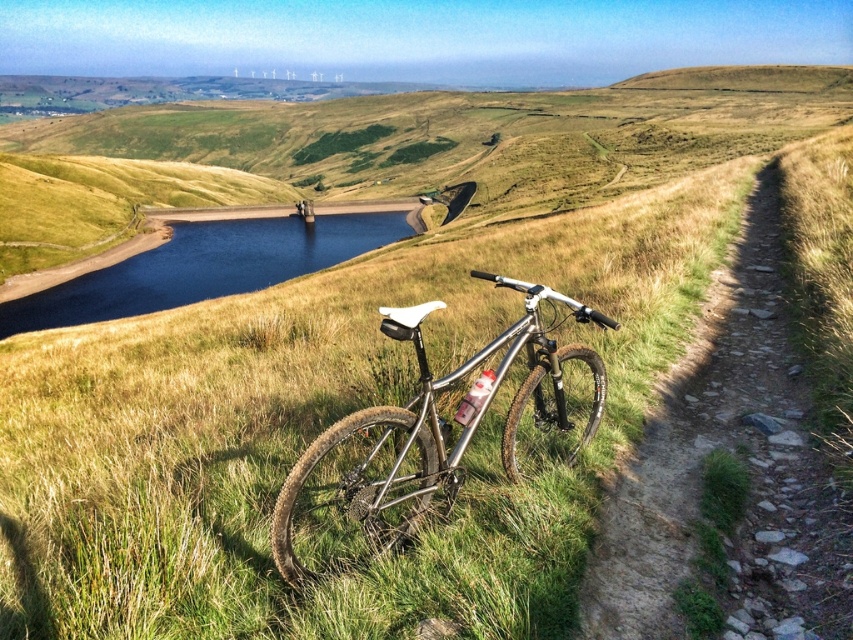
Question: Can you confirm if silver metallic mountain bike at center is smaller than smooth dark blue water at center?

Choices:
 (A) no
 (B) yes

Answer: (B)

Question: Does dirt path at center-right have a lesser width compared to smooth dark blue water at center?

Choices:
 (A) yes
 (B) no

Answer: (A)

Question: Which point is closer to the camera?

Choices:
 (A) (100, 291)
 (B) (389, 477)
 (C) (641, 538)

Answer: (B)

Question: Which of the following is the farthest from the observer?

Choices:
 (A) (387, 320)
 (B) (206, 275)
 (C) (705, 445)

Answer: (B)

Question: Which of the following is the farthest from the observer?

Choices:
 (A) silver metallic mountain bike at center
 (B) smooth dark blue water at center

Answer: (B)

Question: Observing the image, what is the correct spatial positioning of dirt path at center-right in reference to silver metallic mountain bike at center?

Choices:
 (A) right
 (B) left

Answer: (A)